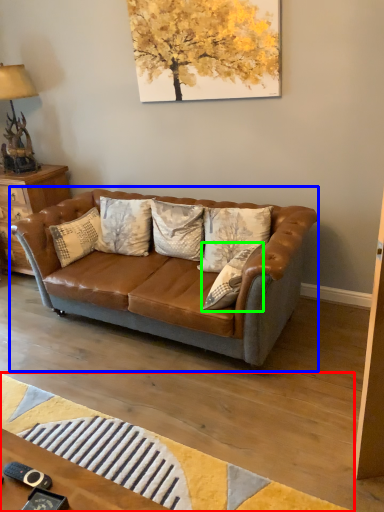
Question: Estimate the real-world distances between objects in this image. Which object is closer to mat (highlighted by a red box), studio couch (highlighted by a blue box) or pillow (highlighted by a green box)?

Choices:
 (A) studio couch
 (B) pillow

Answer: (A)